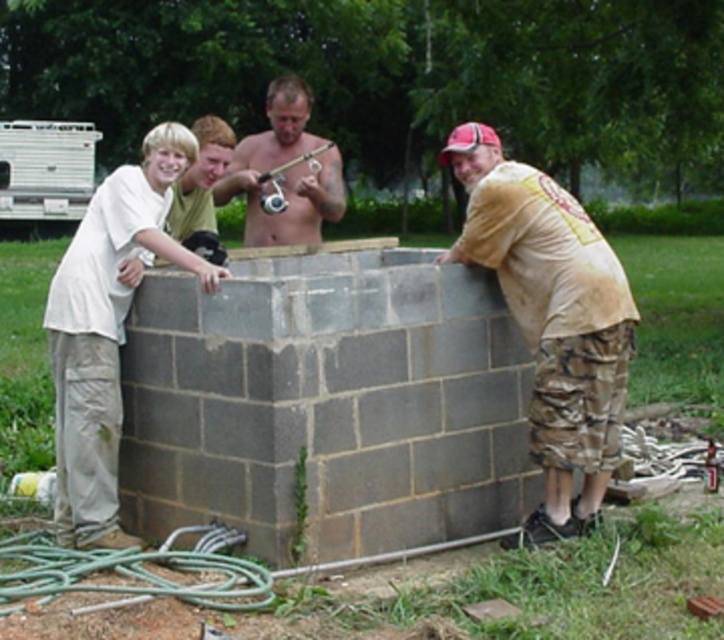
Which of these two, tan/camouflage pants at right or shiny metallic fishing rod at center, stands taller?

Standing taller between the two is shiny metallic fishing rod at center.

Who is positioned more to the left, tan/camouflage pants at right or shiny metallic fishing rod at center?

shiny metallic fishing rod at center

Is point (487, 136) closer to viewer compared to point (295, 209)?

That is True.

Image resolution: width=724 pixels, height=640 pixels. Find the location of `tan/camouflage pants at right`. tan/camouflage pants at right is located at coordinates (551, 320).

From the picture: Can you confirm if tan/camouflage pants at right is smaller than white cotton shirt at left?

Correct, tan/camouflage pants at right occupies less space than white cotton shirt at left.

The height and width of the screenshot is (640, 724). What do you see at coordinates (551, 320) in the screenshot?
I see `tan/camouflage pants at right` at bounding box center [551, 320].

Which is behind, point (538, 346) or point (98, 240)?

Point (538, 346)

Where is `tan/camouflage pants at right`? tan/camouflage pants at right is located at coordinates (551, 320).

Is point (113, 512) positioned after point (321, 179)?

No, (113, 512) is in front of (321, 179).

Is white cotton shirt at left above shiny metallic fishing rod at center?

No, white cotton shirt at left is not above shiny metallic fishing rod at center.

Measure the distance between point [98,346] and camera.

They are 18.90 feet apart.

You are a GUI agent. You are given a task and a screenshot of the screen. Output one action in this format:
    pyautogui.click(x=<x>, y=<y>)
    Task: Click on the white cotton shirt at left
    This screenshot has width=724, height=640.
    Given the screenshot: What is the action you would take?
    pyautogui.click(x=106, y=326)